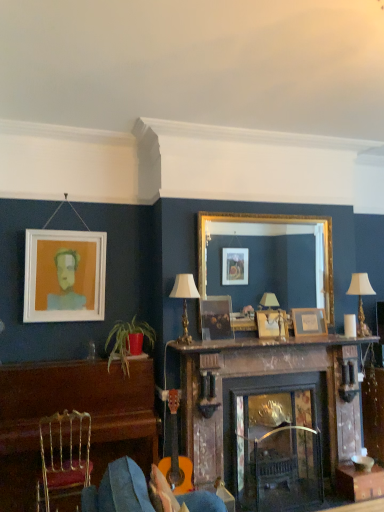
Question: From a real-world perspective, is wooden picture frame at center, the 3th picture frame viewed from the left, located beneath wooden table at center?

Choices:
 (A) yes
 (B) no

Answer: (B)

Question: Is wooden picture frame at center, placed as the second picture frame when sorted from right to left, in front of wooden table at center?

Choices:
 (A) yes
 (B) no

Answer: (B)

Question: Is wooden picture frame at center, the 3th picture frame viewed from the left, turned away from wooden table at center?

Choices:
 (A) no
 (B) yes

Answer: (A)

Question: From a real-world perspective, is wooden picture frame at center, the 3th picture frame viewed from the left, physically above wooden table at center?

Choices:
 (A) no
 (B) yes

Answer: (B)

Question: From the image's perspective, is wooden picture frame at center, placed as the second picture frame when sorted from right to left, above wooden table at center?

Choices:
 (A) no
 (B) yes

Answer: (B)

Question: Is wooden picture frame at center, the 3th picture frame viewed from the left, smaller than wooden table at center?

Choices:
 (A) no
 (B) yes

Answer: (B)

Question: From the image's perspective, is matte wooden picture frame at center, which is the third picture frame in right-to-left order, under gold metallic chair at lower left?

Choices:
 (A) yes
 (B) no

Answer: (B)

Question: Does matte wooden picture frame at center, which is counted as the 2th picture frame, starting from the left, have a smaller size compared to gold metallic chair at lower left?

Choices:
 (A) yes
 (B) no

Answer: (A)

Question: Is there a large distance between matte wooden picture frame at center, which is counted as the 2th picture frame, starting from the left, and gold metallic chair at lower left?

Choices:
 (A) yes
 (B) no

Answer: (A)

Question: Is matte wooden picture frame at center, which is counted as the 2th picture frame, starting from the left, placed right next to gold metallic chair at lower left?

Choices:
 (A) no
 (B) yes

Answer: (A)

Question: Is matte wooden picture frame at center, which is the third picture frame in right-to-left order, outside of gold metallic chair at lower left?

Choices:
 (A) yes
 (B) no

Answer: (A)

Question: From a real-world perspective, is matte wooden picture frame at center, which is the third picture frame in right-to-left order, under gold metallic chair at lower left?

Choices:
 (A) yes
 (B) no

Answer: (B)

Question: Considering the relative sizes of wooden frame at upper center, the 4th picture frame from the left, and green leafy plant in red pot at lower left in the image provided, is wooden frame at upper center, the 4th picture frame from the left, smaller than green leafy plant in red pot at lower left?

Choices:
 (A) yes
 (B) no

Answer: (A)